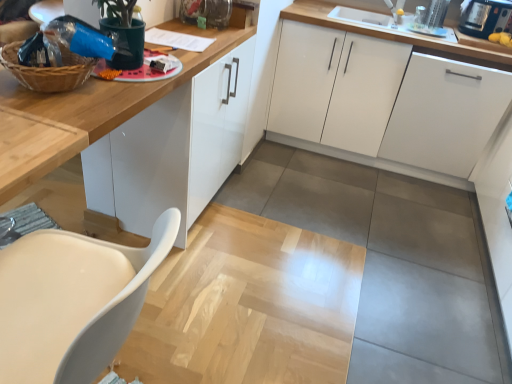
Question: From a real-world perspective, is white matte chair at lower left under woven brown basket at upper left?

Choices:
 (A) no
 (B) yes

Answer: (B)

Question: Is white matte chair at lower left to the right of woven brown basket at upper left from the viewer's perspective?

Choices:
 (A) no
 (B) yes

Answer: (B)

Question: Is white matte chair at lower left located outside woven brown basket at upper left?

Choices:
 (A) yes
 (B) no

Answer: (A)

Question: From the image's perspective, does white matte chair at lower left appear lower than woven brown basket at upper left?

Choices:
 (A) no
 (B) yes

Answer: (B)

Question: Is white matte chair at lower left shorter than woven brown basket at upper left?

Choices:
 (A) no
 (B) yes

Answer: (A)

Question: Considering the relative positions of white matte chair at lower left and woven brown basket at upper left in the image provided, is white matte chair at lower left behind woven brown basket at upper left?

Choices:
 (A) no
 (B) yes

Answer: (A)

Question: Considering the relative sizes of natural wood table at left and white matte chair at lower left in the image provided, is natural wood table at left bigger than white matte chair at lower left?

Choices:
 (A) no
 (B) yes

Answer: (A)

Question: Is natural wood table at left far from white matte chair at lower left?

Choices:
 (A) no
 (B) yes

Answer: (A)

Question: Is natural wood table at left further to the viewer compared to white matte chair at lower left?

Choices:
 (A) no
 (B) yes

Answer: (B)

Question: Can white matte chair at lower left be found inside natural wood table at left?

Choices:
 (A) yes
 (B) no

Answer: (B)

Question: From a real-world perspective, is natural wood table at left physically above white matte chair at lower left?

Choices:
 (A) yes
 (B) no

Answer: (A)

Question: From a real-world perspective, is natural wood table at left below white matte chair at lower left?

Choices:
 (A) yes
 (B) no

Answer: (B)

Question: Does white matte cabinet at right, the third cabinetry viewed from the left, have a larger size compared to white matte cabinet at center, the 2th cabinetry when ordered from right to left?

Choices:
 (A) yes
 (B) no

Answer: (B)